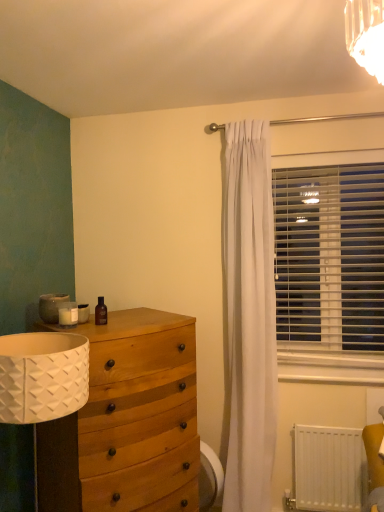
What do you see at coordinates (329, 468) in the screenshot?
I see `white matte radiator at lower right` at bounding box center [329, 468].

Identify the location of white plastic blinds at right. (329, 251).

This screenshot has height=512, width=384. What are the coordinates of `wooden chest of drawers at left` in the screenshot? It's located at (127, 420).

Between brown glass bottle at upper left and wooden chest of drawers at left, which one has larger width?

wooden chest of drawers at left.

Which object is closer to the camera taking this photo, brown glass bottle at upper left or wooden chest of drawers at left?

wooden chest of drawers at left is closer to the camera.

Can you confirm if brown glass bottle at upper left is smaller than wooden chest of drawers at left?

Correct, brown glass bottle at upper left occupies less space than wooden chest of drawers at left.

Which is closer to the camera, (103, 320) or (215, 486)?

Point (103, 320) is closer to the camera than point (215, 486).

Who is bigger, brown glass bottle at upper left or white plastic swivel chair at lower right?

white plastic swivel chair at lower right is bigger.

Is brown glass bottle at upper left at the left side of white plastic swivel chair at lower right?

Indeed, brown glass bottle at upper left is positioned on the left side of white plastic swivel chair at lower right.

Measure the distance from brown glass bottle at upper left to white plastic swivel chair at lower right.

A distance of 36.81 inches exists between brown glass bottle at upper left and white plastic swivel chair at lower right.

Is white plastic swivel chair at lower right not inside white plastic blinds at right?

Yes, white plastic swivel chair at lower right is outside of white plastic blinds at right.

Is white plastic swivel chair at lower right beside white plastic blinds at right?

Answer: No, white plastic swivel chair at lower right is not beside white plastic blinds at right.

Considering the relative sizes of white plastic swivel chair at lower right and white plastic blinds at right in the image provided, is white plastic swivel chair at lower right smaller than white plastic blinds at right?

Indeed, white plastic swivel chair at lower right has a smaller size compared to white plastic blinds at right.

From the image's perspective, which is below, white plastic swivel chair at lower right or white plastic blinds at right?

white plastic swivel chair at lower right appears lower in the image.

Measure the distance between white plastic blinds at right and brown glass bottle at upper left.

→ white plastic blinds at right is 1.23 meters away from brown glass bottle at upper left.

Is white plastic blinds at right taller than brown glass bottle at upper left?

Correct, white plastic blinds at right is much taller as brown glass bottle at upper left.

Locate an element on the screen. window blind above the brown glass bottle at upper left (from a real-world perspective) is located at coordinates (329, 251).

Is white plastic blinds at right aimed at brown glass bottle at upper left?

No, white plastic blinds at right does not turn towards brown glass bottle at upper left.

Does white matte radiator at lower right have a smaller size compared to white plastic swivel chair at lower right?

Actually, white matte radiator at lower right might be larger than white plastic swivel chair at lower right.

In terms of width, does white matte radiator at lower right look wider or thinner when compared to white plastic swivel chair at lower right?

white matte radiator at lower right is thinner than white plastic swivel chair at lower right.

Can white plastic swivel chair at lower right be found inside white matte radiator at lower right?

No, white matte radiator at lower right does not contain white plastic swivel chair at lower right.

Is point (343, 462) closer to viewer compared to point (202, 495)?

That is False.

Is point (100, 324) positioned after point (342, 262)?

No, (100, 324) is closer to viewer.

The height and width of the screenshot is (512, 384). In order to click on window blind above the brown glass bottle at upper left (from the image's perspective) in this screenshot , I will do `click(329, 251)`.

Is brown glass bottle at upper left not close to white plastic blinds at right?

That's right, there is a large distance between brown glass bottle at upper left and white plastic blinds at right.

Considering the sizes of brown glass bottle at upper left and white plastic blinds at right in the image, is brown glass bottle at upper left bigger or smaller than white plastic blinds at right?

brown glass bottle at upper left is smaller than white plastic blinds at right.

Considering the sizes of objects wooden chest of drawers at left and white plastic blinds at right in the image provided, who is taller, wooden chest of drawers at left or white plastic blinds at right?

wooden chest of drawers at left is taller.

Which object is thinner, wooden chest of drawers at left or white plastic blinds at right?

With smaller width is white plastic blinds at right.

From the image's perspective, is wooden chest of drawers at left above or below white plastic blinds at right?

wooden chest of drawers at left is below white plastic blinds at right.

Locate an element on the screen. Image resolution: width=384 pixels, height=512 pixels. toiletry behind the wooden chest of drawers at left is located at coordinates (101, 312).

The width and height of the screenshot is (384, 512). What are the coordinates of `swivel chair lying below the brown glass bottle at upper left (from the image's perspective)` in the screenshot? It's located at (209, 478).

When comparing their distances from brown glass bottle at upper left, does white plastic blinds at right or wooden chest of drawers at left seem closer?

wooden chest of drawers at left.

Looking at the image, which one is located closer to white plastic swivel chair at lower right, white matte radiator at lower right or wooden chest of drawers at left?

wooden chest of drawers at left lies closer to white plastic swivel chair at lower right than the other object.

Estimate the real-world distances between objects in this image. Which object is further from white matte radiator at lower right, white plastic blinds at right or white plastic swivel chair at lower right?

white plastic blinds at right is positioned further to the anchor white matte radiator at lower right.

Based on their spatial positions, is brown glass bottle at upper left or wooden chest of drawers at left closer to white matte radiator at lower right?

wooden chest of drawers at left is positioned closer to the anchor white matte radiator at lower right.

Based on their spatial positions, is brown glass bottle at upper left or white matte radiator at lower right closer to white plastic blinds at right?

white matte radiator at lower right is closer to white plastic blinds at right.

Estimate the real-world distances between objects in this image. Which object is closer to white matte radiator at lower right, wooden chest of drawers at left or brown glass bottle at upper left?

Based on the image, wooden chest of drawers at left appears to be nearer to white matte radiator at lower right.

Looking at the image, which one is located further to white plastic blinds at right, white plastic swivel chair at lower right or wooden chest of drawers at left?

white plastic swivel chair at lower right is further to white plastic blinds at right.

Which object lies nearer to the anchor point wooden chest of drawers at left, brown glass bottle at upper left or white plastic blinds at right?

brown glass bottle at upper left.

Identify the location of swivel chair between brown glass bottle at upper left and white matte radiator at lower right from left to right. (209, 478).

I want to click on the chest of drawers between brown glass bottle at upper left and white plastic swivel chair at lower right vertically, so click(x=127, y=420).

Find the location of a particular element. The width and height of the screenshot is (384, 512). chest of drawers between brown glass bottle at upper left and white matte radiator at lower right in the horizontal direction is located at coordinates (127, 420).

Identify the location of chest of drawers between white plastic blinds at right and white plastic swivel chair at lower right from top to bottom. This screenshot has height=512, width=384. (127, 420).